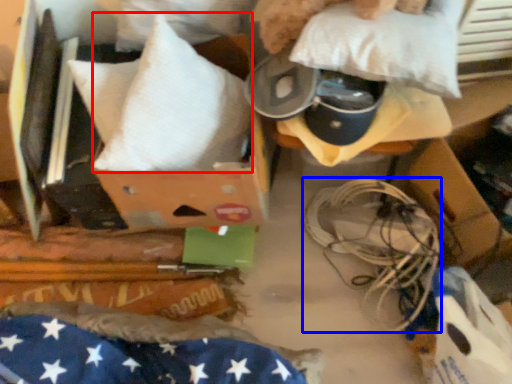
Question: Among these objects, which one is nearest to the camera, pillow (highlighted by a red box) or wire (highlighted by a blue box)?

Choices:
 (A) pillow
 (B) wire

Answer: (A)